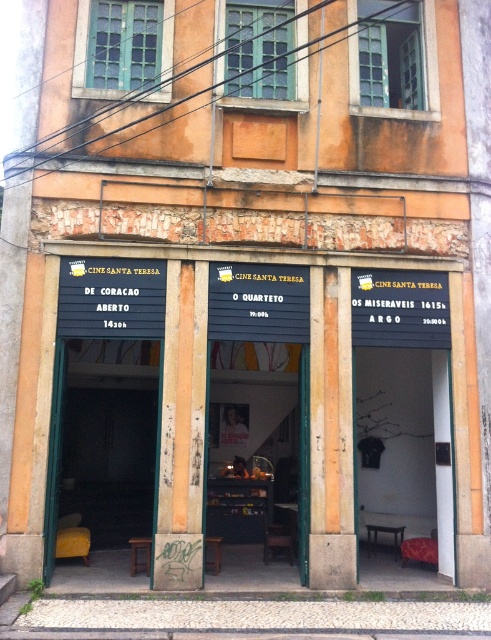
Does black painted wood signboard at center have a lesser width compared to yellowish wood pillar at center?

In fact, black painted wood signboard at center might be wider than yellowish wood pillar at center.

Is black painted wood signboard at center positioned in front of yellowish wood pillar at center?

That is False.

Locate an element on the screen. black painted wood signboard at center is located at coordinates (312, 401).

At what (x,y) coordinates should I click in order to perform the action: click on black painted wood signboard at center. Please return your answer as a coordinate pair (x, y). The height and width of the screenshot is (640, 491). Looking at the image, I should click on (312, 401).

Can you confirm if black painted wood signboard at center is positioned above yellow fabric chair at left?

Correct, black painted wood signboard at center is located above yellow fabric chair at left.

Does point (349, 404) come behind point (84, 442)?

No.

The image size is (491, 640). I want to click on black painted wood signboard at center, so click(312, 401).

Does wooden chair at center have a greater width compared to yellowish wood pillar at center?

Yes.

Is wooden chair at center positioned at the back of yellowish wood pillar at center?

Yes, wooden chair at center is further from the viewer.

Between point (380, 419) and point (342, 401), which one is positioned in front?

Point (342, 401) is in front.

I want to click on wooden chair at center, so click(x=406, y=445).